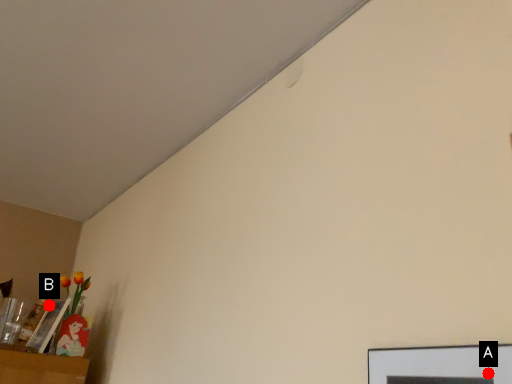
Question: Two points are circled on the image, labeled by A and B beside each circle. Which point is farther from the camera taking this photo?

Choices:
 (A) A is further
 (B) B is further

Answer: (B)